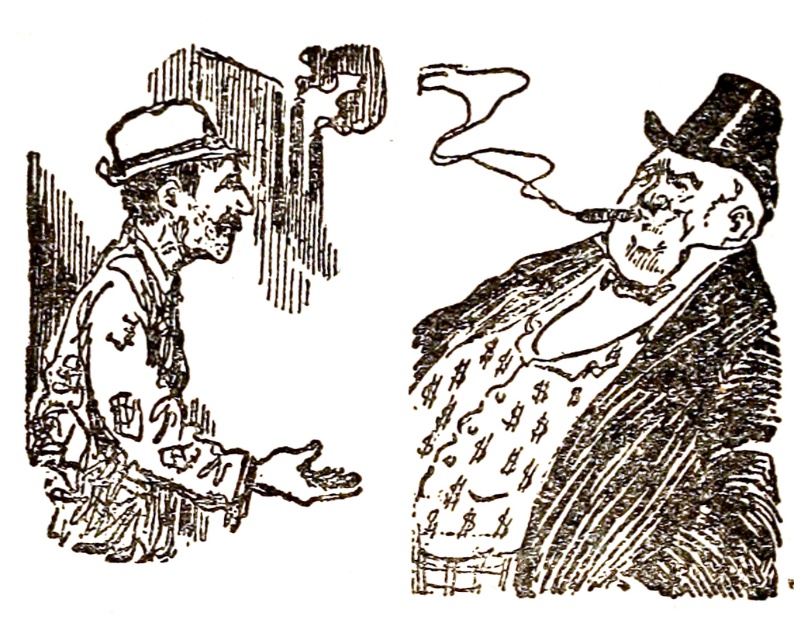
You are a character in the image and want to pick up the smooth paper money at right and the black paper hat at left. Which object will you need to move towards if you are currently standing near the man facing right?

The smooth paper money at right is located on the right side of the image, so you need to move towards the right to pick it up. The black paper hat at left is on the left side, so you would move towards the left for that. However, since you are already near the man facing right, who is on the left side, moving towards the right would be closer to the smooth paper money at right. Wait, but the man facing right is on the left side. Hmm, need to clarify the exact positions based on the scene description.

You are an art student analyzing the black and white illustration. You notice two points marked in the image. The first point is at coordinates point (515, 296), and the second is at point (114, 266). Which of these points is closer to you as you view the image?

Point (515, 296) is further to the viewer than point (114, 266), so the point closer to you is point (114, 266).